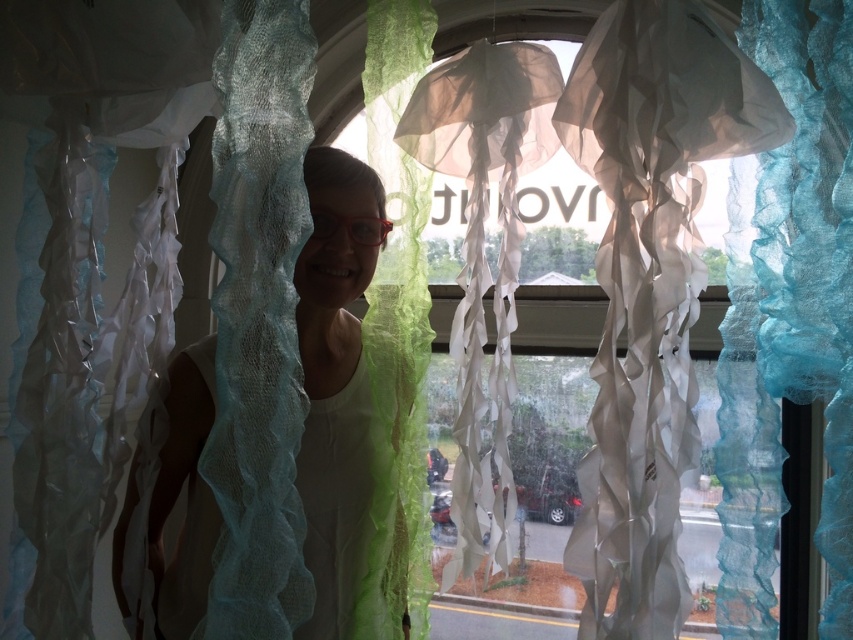
You are a visitor at an art exhibit and notice the white sheer fabric at center and the red translucent goggles at center. Which object is taller in the installation?

The white sheer fabric at center is much taller than the red translucent goggles at center.

You are an interior designer assessing a room with a decorative installation. You see the white sheer fabric at center and the red translucent goggles at center. Which object would block more of the view through the installation?

The white sheer fabric at center is larger in size than the red translucent goggles at center, so it would block more of the view through the installation.